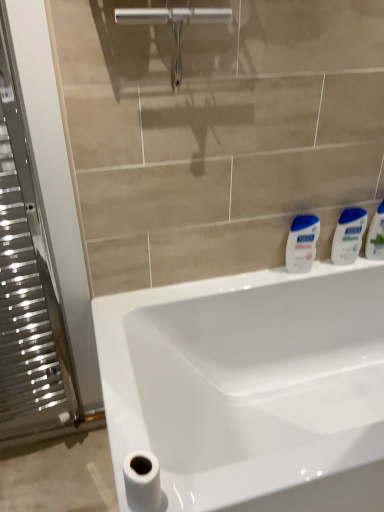
Question: From a real-world perspective, does white glossy lotion at right, the second toiletry in the right-to-left sequence, stand above white matte toilet paper at lower left?

Choices:
 (A) yes
 (B) no

Answer: (A)

Question: From the image's perspective, is white glossy lotion at right, arranged as the first toiletry when viewed from the left, on white matte toilet paper at lower left?

Choices:
 (A) no
 (B) yes

Answer: (B)

Question: Is white glossy lotion at right, the second toiletry in the right-to-left sequence, oriented towards white matte toilet paper at lower left?

Choices:
 (A) yes
 (B) no

Answer: (B)

Question: Is white glossy lotion at right, arranged as the first toiletry when viewed from the left, surrounding white matte toilet paper at lower left?

Choices:
 (A) yes
 (B) no

Answer: (B)

Question: Considering the relative sizes of white glossy lotion at right, the second toiletry in the right-to-left sequence, and white matte toilet paper at lower left in the image provided, is white glossy lotion at right, the second toiletry in the right-to-left sequence, shorter than white matte toilet paper at lower left?

Choices:
 (A) yes
 (B) no

Answer: (B)

Question: From their relative heights in the image, would you say silver metallic tap at upper center is taller or shorter than white glossy lotion at right, which is counted as the second toiletry, starting from the left?

Choices:
 (A) short
 (B) tall

Answer: (A)

Question: From the image's perspective, is silver metallic tap at upper center positioned above or below white glossy lotion at right, the 1th toiletry in the right-to-left sequence?

Choices:
 (A) below
 (B) above

Answer: (B)

Question: Considering the positions of silver metallic tap at upper center and white glossy lotion at right, which is counted as the second toiletry, starting from the left, in the image, is silver metallic tap at upper center wider or thinner than white glossy lotion at right, which is counted as the second toiletry, starting from the left,?

Choices:
 (A) wide
 (B) thin

Answer: (B)

Question: In terms of size, does silver metallic tap at upper center appear bigger or smaller than white glossy lotion at right, which is counted as the second toiletry, starting from the left?

Choices:
 (A) big
 (B) small

Answer: (A)

Question: Considering the positions of point (137, 499) and point (345, 234), is point (137, 499) closer or farther from the camera than point (345, 234)?

Choices:
 (A) closer
 (B) farther

Answer: (A)

Question: Relative to white glossy lotion at right, the second toiletry in the right-to-left sequence, is white matte toilet paper at lower left in front or behind?

Choices:
 (A) behind
 (B) front

Answer: (B)

Question: Is white matte toilet paper at lower left bigger or smaller than white glossy lotion at right, arranged as the first toiletry when viewed from the left?

Choices:
 (A) big
 (B) small

Answer: (B)

Question: Do you think white matte toilet paper at lower left is within white glossy lotion at right, arranged as the first toiletry when viewed from the left, or outside of it?

Choices:
 (A) inside
 (B) outside

Answer: (B)

Question: Is white matte toilet paper at lower left taller or shorter than silver metallic radiator at left?

Choices:
 (A) short
 (B) tall

Answer: (A)

Question: Is point (134, 495) closer or farther from the camera than point (6, 79)?

Choices:
 (A) farther
 (B) closer

Answer: (B)